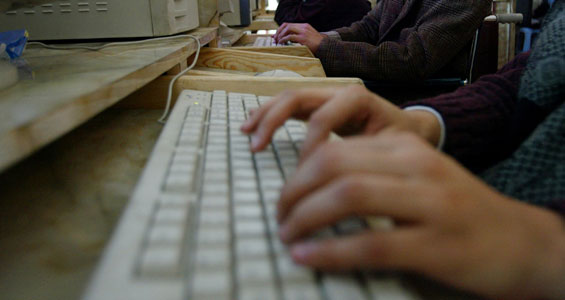
The width and height of the screenshot is (565, 300). Find the location of `keyboard`. keyboard is located at coordinates (233, 175), (266, 41).